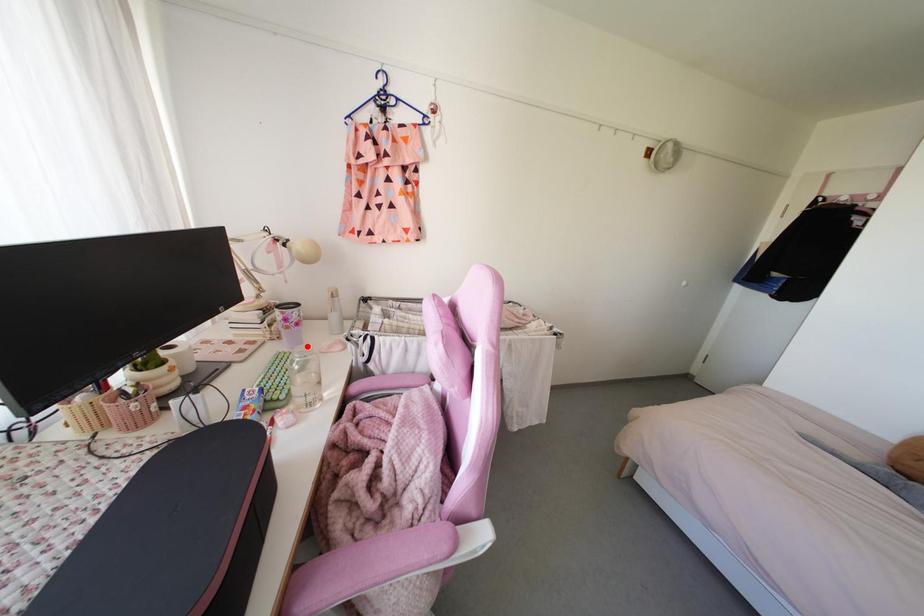
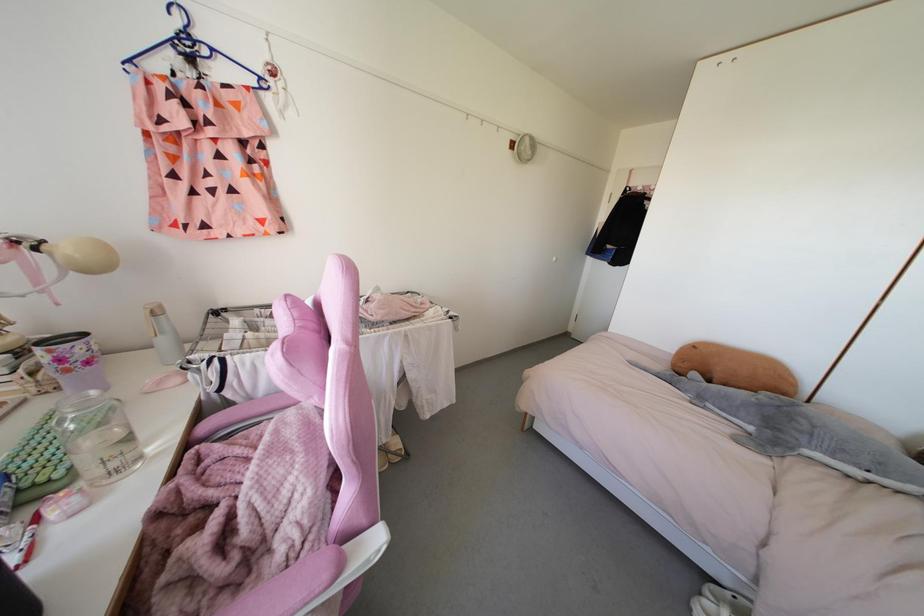
Where in the second image is the point corresponding to the highlighted location from the first image?

(92, 392)